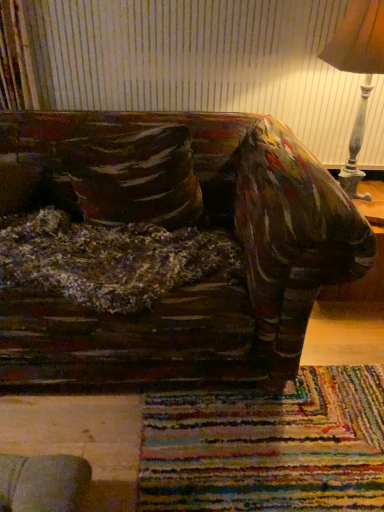
Question: Is velvety brown pillow at left completely or partially outside of wooden lampshade at upper right?

Choices:
 (A) no
 (B) yes

Answer: (B)

Question: Is velvety brown pillow at left positioned in front of wooden lampshade at upper right?

Choices:
 (A) yes
 (B) no

Answer: (B)

Question: Considering the relative sizes of velvety brown pillow at left and wooden lampshade at upper right in the image provided, is velvety brown pillow at left thinner than wooden lampshade at upper right?

Choices:
 (A) no
 (B) yes

Answer: (B)

Question: From the image's perspective, would you say velvety brown pillow at left is shown under wooden lampshade at upper right?

Choices:
 (A) yes
 (B) no

Answer: (A)

Question: Can you confirm if velvety brown pillow at left is positioned to the left of wooden lampshade at upper right?

Choices:
 (A) yes
 (B) no

Answer: (A)

Question: Is velvety brown pillow at left wider than wooden lampshade at upper right?

Choices:
 (A) yes
 (B) no

Answer: (B)

Question: From the image's perspective, is wooden lampshade at upper right over velvety brown pillow at left?

Choices:
 (A) yes
 (B) no

Answer: (A)

Question: Can you confirm if wooden lampshade at upper right is positioned to the left of velvety brown pillow at left?

Choices:
 (A) no
 (B) yes

Answer: (A)

Question: Is there a large distance between wooden lampshade at upper right and velvety brown pillow at left?

Choices:
 (A) yes
 (B) no

Answer: (B)

Question: From a real-world perspective, is wooden lampshade at upper right positioned over velvety brown pillow at left based on gravity?

Choices:
 (A) no
 (B) yes

Answer: (B)

Question: Does wooden lampshade at upper right have a greater width compared to velvety brown pillow at left?

Choices:
 (A) no
 (B) yes

Answer: (B)

Question: Can you confirm if wooden lampshade at upper right is smaller than velvety brown pillow at left?

Choices:
 (A) no
 (B) yes

Answer: (A)

Question: From the image's perspective, is wooden lampshade at upper right above or below velvety brown pillow at left?

Choices:
 (A) above
 (B) below

Answer: (A)